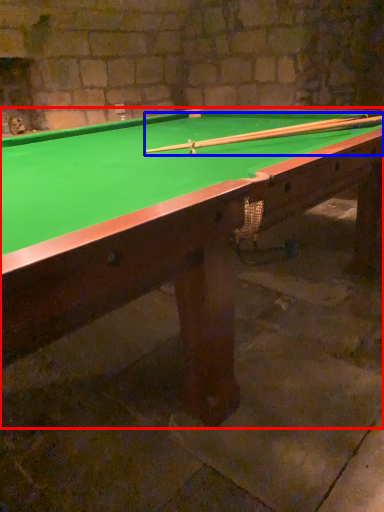
Question: Which point is closer to the camera, billiard table (highlighted by a red box) or cue (highlighted by a blue box)?

Choices:
 (A) billiard table
 (B) cue

Answer: (A)